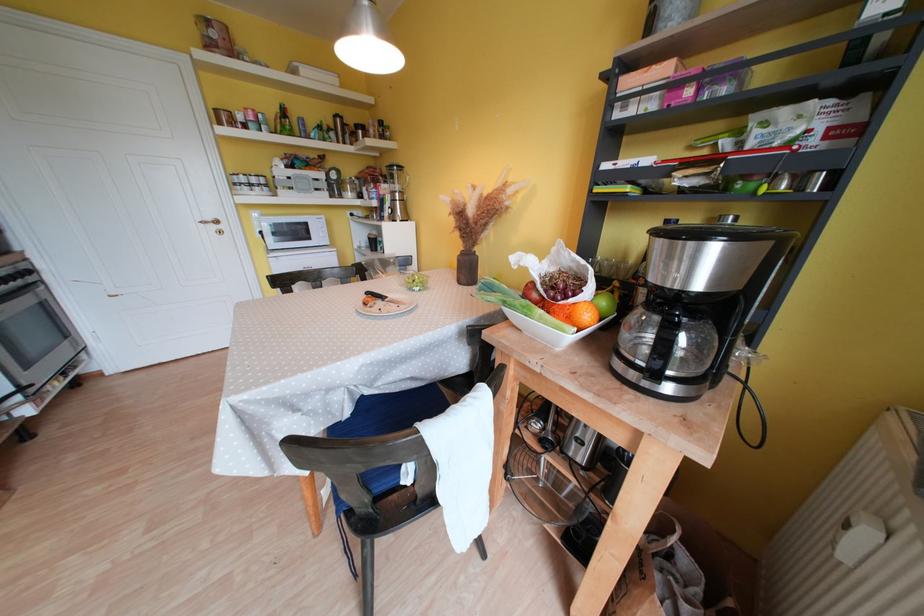
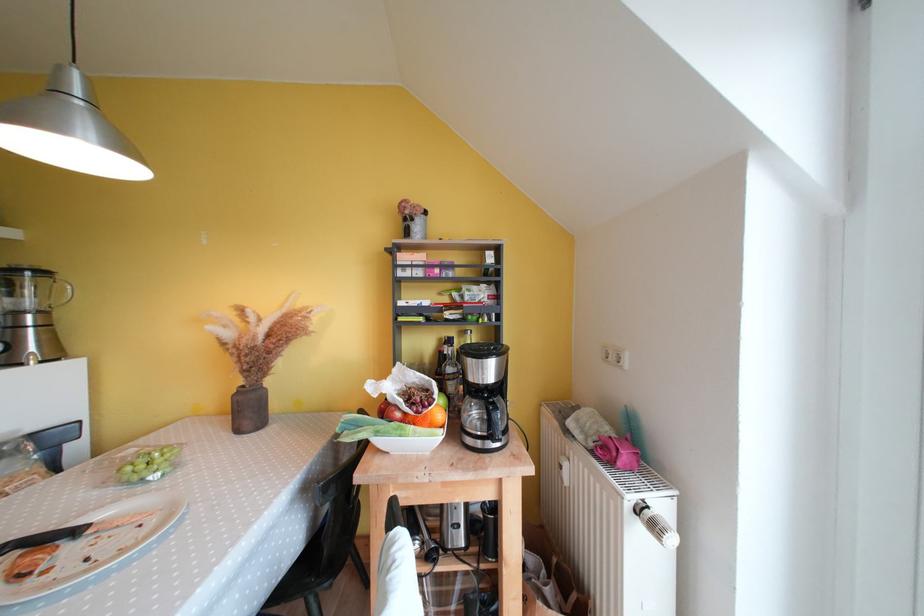
The point at (407, 196) is marked in the first image. Where is the corresponding point in the second image?

(49, 315)